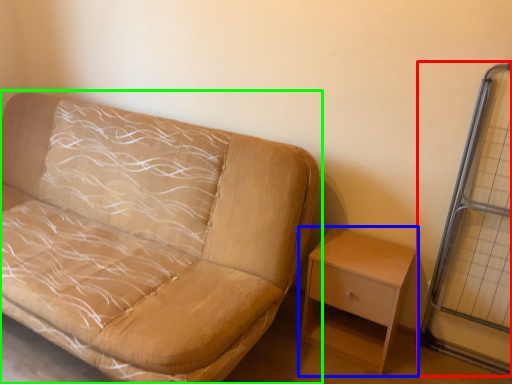
Question: Which object is positioned farthest from glass door (highlighted by a red box)? Select from nightstand (highlighted by a blue box) and studio couch (highlighted by a green box).

Choices:
 (A) nightstand
 (B) studio couch

Answer: (B)